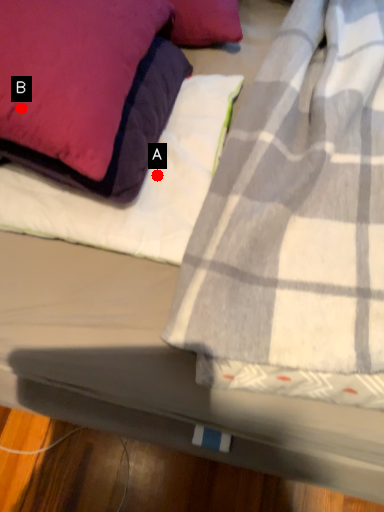
Question: Two points are circled on the image, labeled by A and B beside each circle. Which point is farther from the camera taking this photo?

Choices:
 (A) A is further
 (B) B is further

Answer: (A)